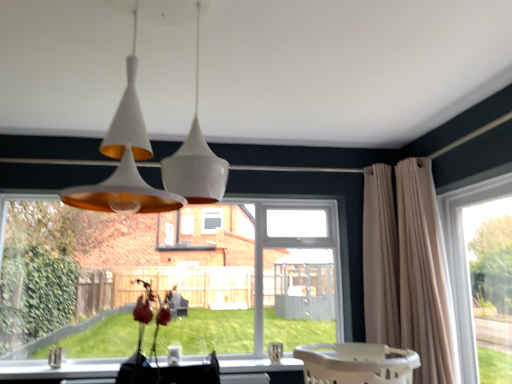
Question: Is transparent glass window at right, the first window when ordered from right to left, looking in the opposite direction of white glossy pendant light at upper center?

Choices:
 (A) yes
 (B) no

Answer: (B)

Question: Does transparent glass window at right, the first window when ordered from right to left, have a lesser width compared to white glossy pendant light at upper center?

Choices:
 (A) no
 (B) yes

Answer: (B)

Question: Would you say transparent glass window at right, which is the second window in left-to-right order, is outside white glossy pendant light at upper center?

Choices:
 (A) yes
 (B) no

Answer: (A)

Question: Considering the relative sizes of transparent glass window at right, which is the second window in left-to-right order, and white glossy pendant light at upper center in the image provided, is transparent glass window at right, which is the second window in left-to-right order, smaller than white glossy pendant light at upper center?

Choices:
 (A) no
 (B) yes

Answer: (B)

Question: Considering the relative sizes of transparent glass window at right, which is the second window in left-to-right order, and white glossy pendant light at upper center in the image provided, is transparent glass window at right, which is the second window in left-to-right order, shorter than white glossy pendant light at upper center?

Choices:
 (A) no
 (B) yes

Answer: (A)

Question: Is transparent glass window at right, which is the second window in left-to-right order, wider than white glossy pendant light at upper center?

Choices:
 (A) yes
 (B) no

Answer: (B)

Question: Is beige plastic baby carriage at lower center beside beige fabric curtain at right, which is the 2th curtain from right to left?

Choices:
 (A) no
 (B) yes

Answer: (A)

Question: Considering the relative sizes of beige plastic baby carriage at lower center and beige fabric curtain at right, marked as the 1th curtain in a left-to-right arrangement, in the image provided, is beige plastic baby carriage at lower center wider than beige fabric curtain at right, marked as the 1th curtain in a left-to-right arrangement,?

Choices:
 (A) no
 (B) yes

Answer: (B)

Question: Is beige plastic baby carriage at lower center surrounding beige fabric curtain at right, marked as the 1th curtain in a left-to-right arrangement?

Choices:
 (A) yes
 (B) no

Answer: (B)

Question: From the image's perspective, is beige plastic baby carriage at lower center located above beige fabric curtain at right, marked as the 1th curtain in a left-to-right arrangement?

Choices:
 (A) no
 (B) yes

Answer: (A)

Question: Is beige plastic baby carriage at lower center oriented away from beige fabric curtain at right, which is the 2th curtain from right to left?

Choices:
 (A) yes
 (B) no

Answer: (B)

Question: Is beige plastic baby carriage at lower center shorter than beige fabric curtain at right, marked as the 1th curtain in a left-to-right arrangement?

Choices:
 (A) yes
 (B) no

Answer: (A)

Question: From the image's perspective, is transparent glass window at right, the first window when ordered from right to left, above clear glass window at lower left, marked as the second window in a right-to-left arrangement?

Choices:
 (A) no
 (B) yes

Answer: (B)